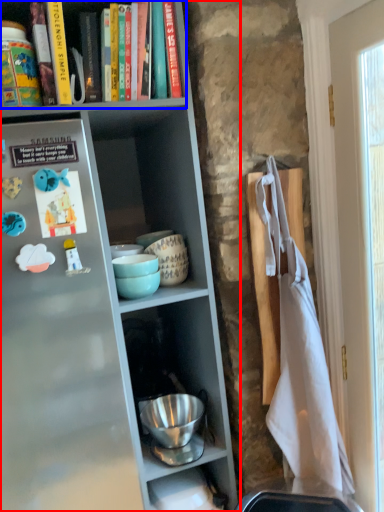
Question: Which point is further to the camera, shelf (highlighted by a red box) or book (highlighted by a blue box)?

Choices:
 (A) shelf
 (B) book

Answer: (B)